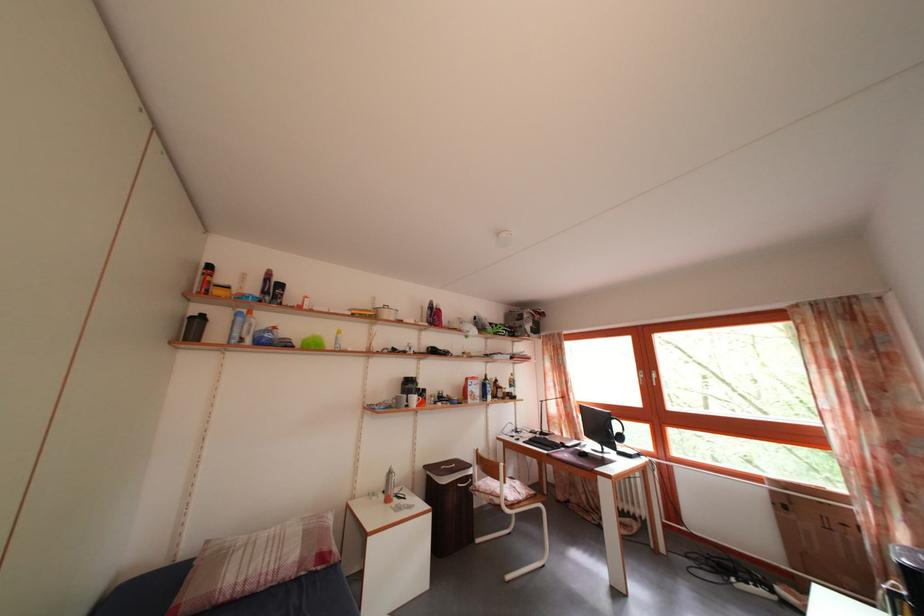
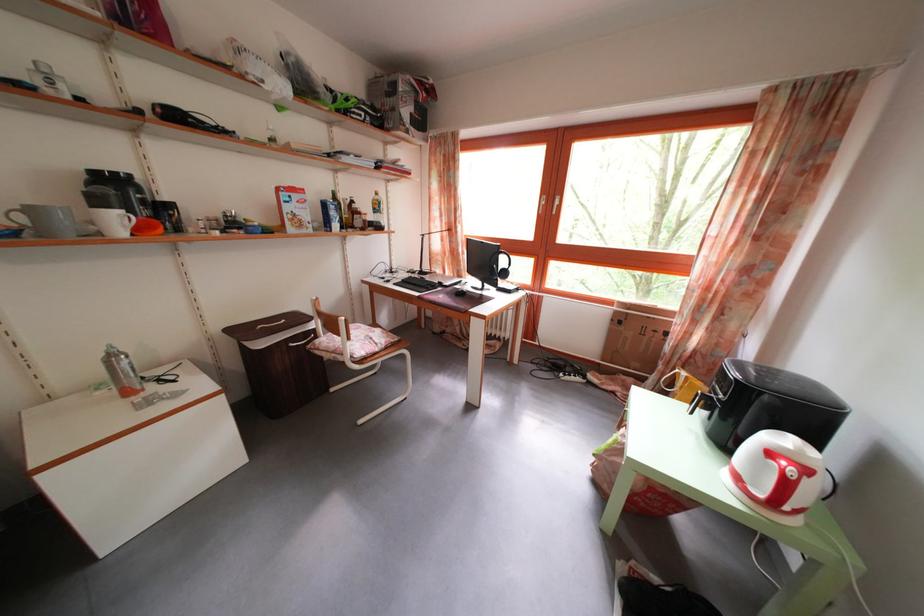
Where in the second image is the point corresponding to point 402,408 from the first image?

(30, 225)